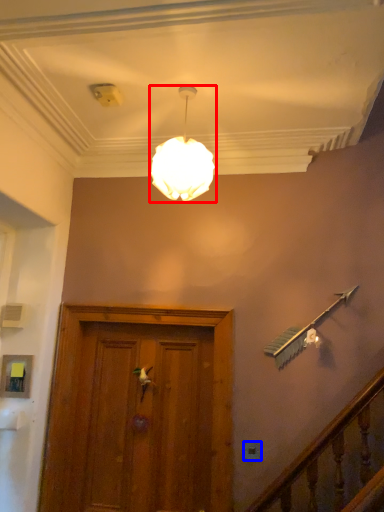
Question: Which point is further to the camera, lamp (highlighted by a red box) or electric outlet (highlighted by a blue box)?

Choices:
 (A) lamp
 (B) electric outlet

Answer: (B)